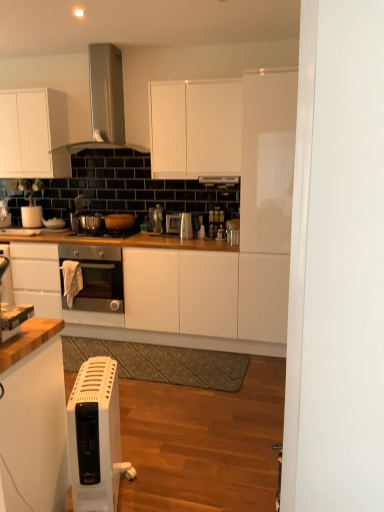
Question: From a real-world perspective, is satin silver range hood at upper center above or below white plastic toaster at lower left, which is counted as the 5th appliance, starting from the right?

Choices:
 (A) below
 (B) above

Answer: (B)

Question: Considering the positions of point (107, 82) and point (4, 339), is point (107, 82) closer or farther from the camera than point (4, 339)?

Choices:
 (A) farther
 (B) closer

Answer: (A)

Question: Based on their relative distances, which object is farther from the white plastic heater at lower left?

Choices:
 (A) white matte paper towel holder at left, which is the seventh appliance in front-to-back order
 (B) white matte cabinet at upper center, the 2th cabinetry positioned from the left
 (C) satin silver kettle at center, which is the 1th appliance in right-to-left order
 (D) satin silver toaster at center, which ranks as the 5th appliance in front-to-back order
 (E) shiny metallic gas stove at center

Answer: (A)

Question: Estimate the real-world distances between objects in this image. Which object is closer to the satin silver kettle at center, which ranks as the second appliance in front-to-back order?

Choices:
 (A) white matte cabinet at upper left, arranged as the first cabinetry when viewed from the left
 (B) matte brown pot at center, placed as the 4th appliance when sorted from back to front
 (C) white plastic toaster at lower left, acting as the 1th appliance starting from the front
 (D) white matte cabinet at upper center, positioned as the first cabinetry in right-to-left order
 (E) satin silver toaster at center, the 3th appliance from the right

Answer: (E)